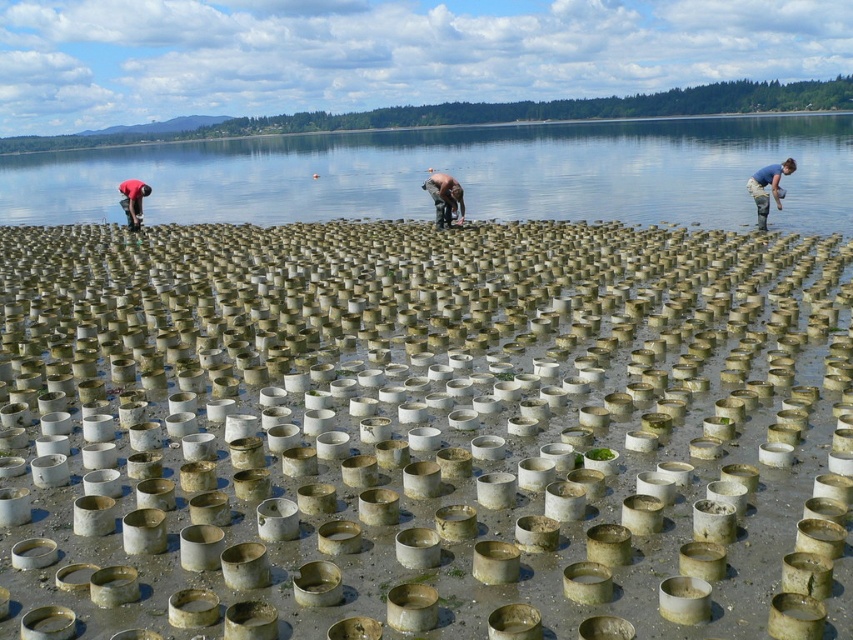
Does greenish-gray concrete cylinders at center appear over red fabric shirt at left?

No, greenish-gray concrete cylinders at center is not above red fabric shirt at left.

This screenshot has width=853, height=640. Find the location of `greenish-gray concrete cylinders at center`. greenish-gray concrete cylinders at center is located at coordinates click(x=421, y=432).

This screenshot has height=640, width=853. Find the location of `greenish-gray concrete cylinders at center`. greenish-gray concrete cylinders at center is located at coordinates (421, 432).

The width and height of the screenshot is (853, 640). Describe the element at coordinates (459, 173) in the screenshot. I see `green algae-covered rocks at center` at that location.

Which is behind, point (247, 164) or point (762, 224)?

The point (247, 164) is more distant.

Is point (486, 131) closer to camera compared to point (756, 189)?

That is False.

Locate an element on the screen. green algae-covered rocks at center is located at coordinates (459, 173).

Does blue rubber boot at lower right have a larger size compared to brown leather jacket at center?

Yes, blue rubber boot at lower right is bigger than brown leather jacket at center.

Is blue rubber boot at lower right thinner than brown leather jacket at center?

No, blue rubber boot at lower right is not thinner than brown leather jacket at center.

What do you see at coordinates (764, 186) in the screenshot? I see `blue rubber boot at lower right` at bounding box center [764, 186].

I want to click on blue rubber boot at lower right, so click(x=764, y=186).